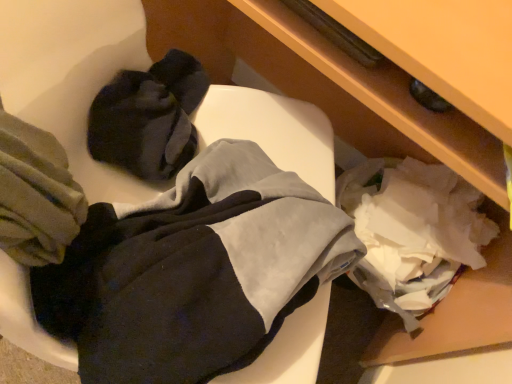
This screenshot has height=384, width=512. What do you see at coordinates (194, 271) in the screenshot? I see `dark gray fleece pants at center` at bounding box center [194, 271].

You are a GUI agent. You are given a task and a screenshot of the screen. Output one action in this format:
    pyautogui.click(x=<x>, y=<y>)
    Task: Click on the dark gray fleece pants at center
    This screenshot has height=384, width=512.
    Given the screenshot: What is the action you would take?
    pyautogui.click(x=194, y=271)

The width and height of the screenshot is (512, 384). I want to click on dark gray fleece pants at center, so click(194, 271).